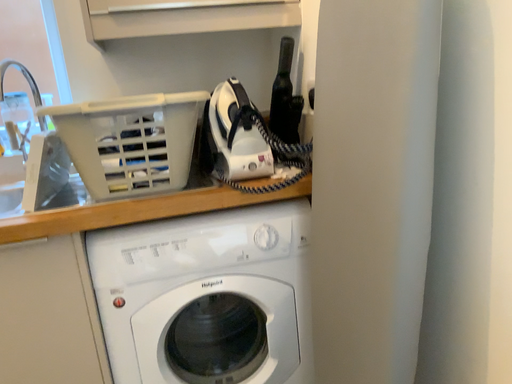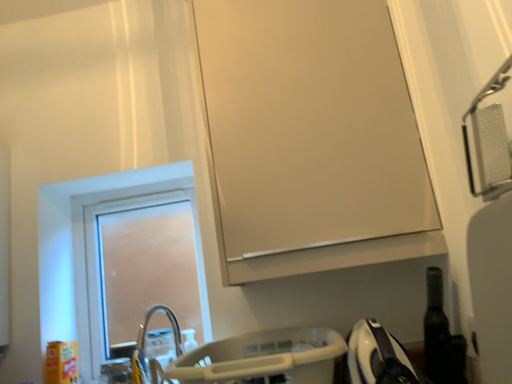
Question: Which way did the camera rotate in the video?

Choices:
 (A) rotated downward
 (B) rotated upward

Answer: (B)